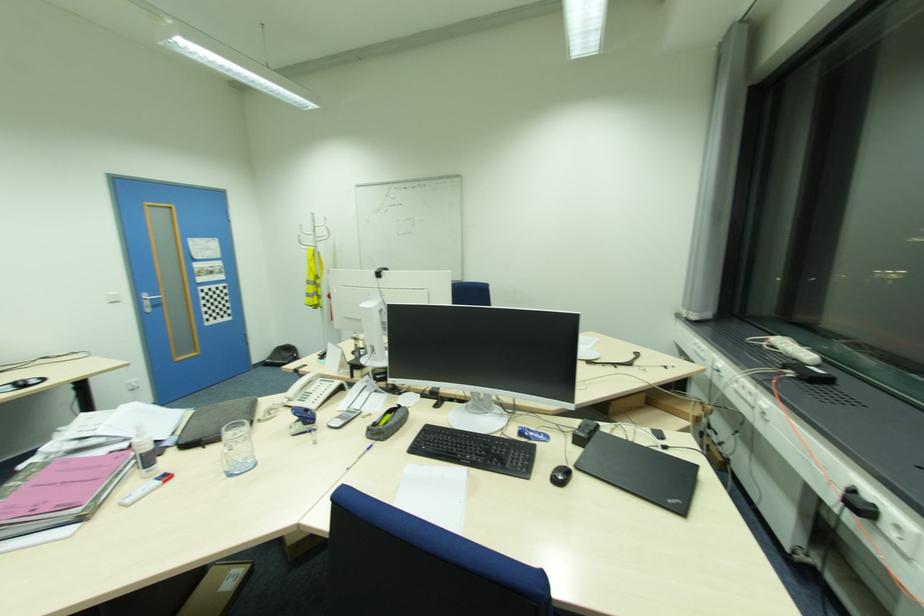
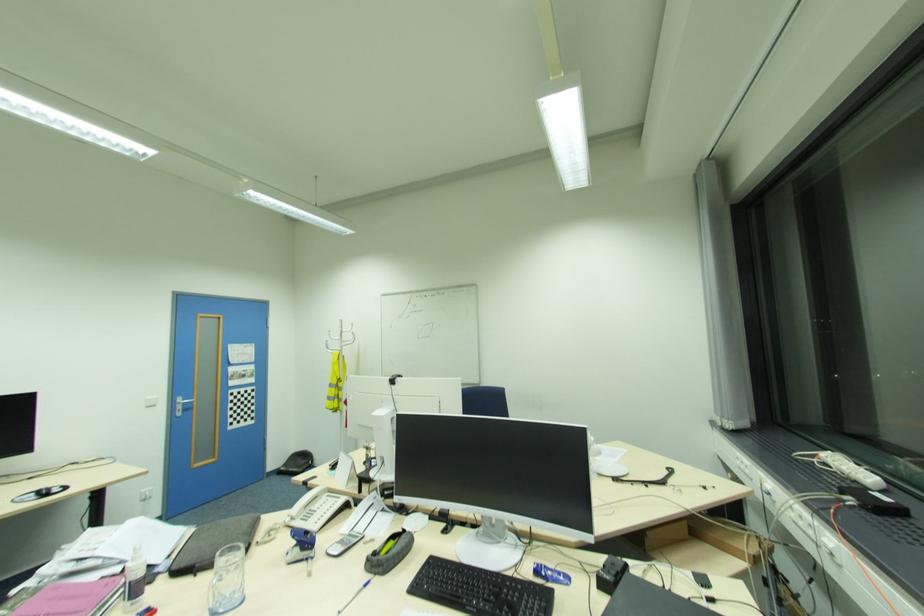
What movement of the cameraman would produce the second image?

The cameraman moved toward right, backward.